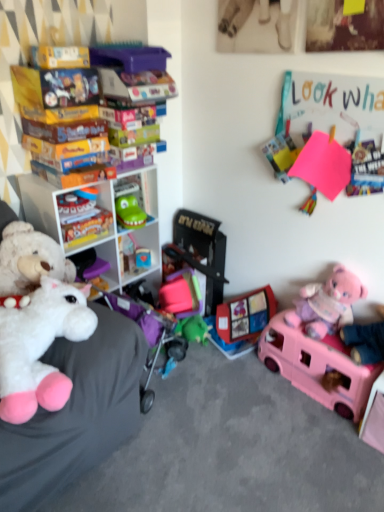
Question: Is white plastic shelf at left, placed as the second shelf when sorted from top to bottom, facing towards pink plastic toy car at lower right, positioned as the first toy in right-to-left order?

Choices:
 (A) no
 (B) yes

Answer: (B)

Question: From a real-world perspective, does white plastic shelf at left, placed as the second shelf when sorted from top to bottom, stand above pink plastic toy car at lower right, positioned as the first toy in right-to-left order?

Choices:
 (A) no
 (B) yes

Answer: (B)

Question: Considering the relative sizes of white plastic shelf at left, placed as the 1th shelf when sorted from bottom to top, and pink plastic toy car at lower right, which ranks as the fifth toy in left-to-right order, in the image provided, is white plastic shelf at left, placed as the 1th shelf when sorted from bottom to top, shorter than pink plastic toy car at lower right, which ranks as the fifth toy in left-to-right order,?

Choices:
 (A) yes
 (B) no

Answer: (B)

Question: Are white plastic shelf at left, placed as the 1th shelf when sorted from bottom to top, and pink plastic toy car at lower right, positioned as the first toy in right-to-left order, far apart?

Choices:
 (A) yes
 (B) no

Answer: (A)

Question: Is the position of white plastic shelf at left, placed as the 1th shelf when sorted from bottom to top, less distant than that of pink plastic toy car at lower right, which ranks as the fifth toy in left-to-right order?

Choices:
 (A) no
 (B) yes

Answer: (A)

Question: Considering the positions of matte plastic toy at center, acting as the second toy starting from the right, and plastic toy car at center, the third toy from the left, in the image, is matte plastic toy at center, acting as the second toy starting from the right, bigger or smaller than plastic toy car at center, the third toy from the left,?

Choices:
 (A) big
 (B) small

Answer: (A)

Question: From a real-world perspective, is matte plastic toy at center, the 4th toy from the left, above or below plastic toy car at center, the third toy from the left?

Choices:
 (A) below
 (B) above

Answer: (A)

Question: Considering the positions of matte plastic toy at center, the 4th toy from the left, and plastic toy car at center, which is counted as the third toy, starting from the right, in the image, is matte plastic toy at center, the 4th toy from the left, wider or thinner than plastic toy car at center, which is counted as the third toy, starting from the right,?

Choices:
 (A) thin
 (B) wide

Answer: (B)

Question: From their relative heights in the image, would you say matte plastic toy at center, acting as the second toy starting from the right, is taller or shorter than plastic toy car at center, which is counted as the third toy, starting from the right?

Choices:
 (A) tall
 (B) short

Answer: (B)

Question: From a real-world perspective, is green plastic toy at center, which is the 1th shelf in top-to-bottom order, above or below pink plush teddy bear at lower right?

Choices:
 (A) above
 (B) below

Answer: (A)

Question: Is point (125, 223) positioned closer to the camera than point (332, 332)?

Choices:
 (A) closer
 (B) farther

Answer: (B)

Question: Relative to pink plush teddy bear at lower right, is green plastic toy at center, which is the 2th shelf from bottom to top, in front or behind?

Choices:
 (A) behind
 (B) front

Answer: (A)

Question: In terms of height, does green plastic toy at center, which is the 1th shelf in top-to-bottom order, look taller or shorter compared to pink plush teddy bear at lower right?

Choices:
 (A) short
 (B) tall

Answer: (A)

Question: Do you think pink plush teddy bear at lower right is within plastic toy car at center, the third toy from the left, or outside of it?

Choices:
 (A) inside
 (B) outside

Answer: (B)

Question: In the image, is pink plush teddy bear at lower right positioned in front of or behind plastic toy car at center, which is counted as the third toy, starting from the right?

Choices:
 (A) behind
 (B) front

Answer: (B)